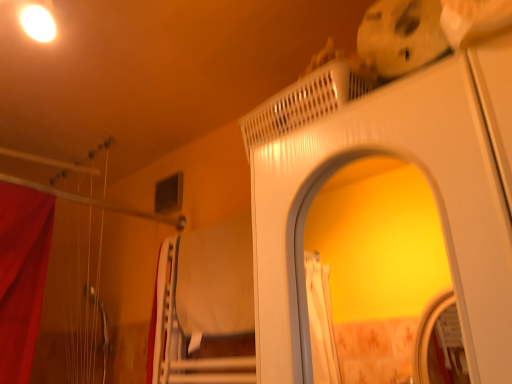
Question: Is white fabric curtain at lower left further to the viewer compared to white glossy screen door at upper center?

Choices:
 (A) no
 (B) yes

Answer: (B)

Question: Is white fabric curtain at lower left shorter than white glossy screen door at upper center?

Choices:
 (A) yes
 (B) no

Answer: (A)

Question: Is white fabric curtain at lower left to the right of white glossy screen door at upper center from the viewer's perspective?

Choices:
 (A) no
 (B) yes

Answer: (A)

Question: From the image's perspective, is white fabric curtain at lower left located above white glossy screen door at upper center?

Choices:
 (A) yes
 (B) no

Answer: (B)

Question: Is white fabric curtain at lower left taller than white glossy screen door at upper center?

Choices:
 (A) no
 (B) yes

Answer: (A)

Question: Is white fabric curtain at lower left thinner than white glossy screen door at upper center?

Choices:
 (A) no
 (B) yes

Answer: (B)

Question: Considering the relative sizes of white glossy screen door at upper center and white fabric curtain at lower left in the image provided, is white glossy screen door at upper center bigger than white fabric curtain at lower left?

Choices:
 (A) no
 (B) yes

Answer: (B)

Question: Can you confirm if white glossy screen door at upper center is wider than white fabric curtain at lower left?

Choices:
 (A) yes
 (B) no

Answer: (A)

Question: Is white glossy screen door at upper center at the right side of white fabric curtain at lower left?

Choices:
 (A) yes
 (B) no

Answer: (A)

Question: Does white glossy screen door at upper center have a greater height compared to white fabric curtain at lower left?

Choices:
 (A) yes
 (B) no

Answer: (A)

Question: Is the surface of white glossy screen door at upper center in direct contact with white fabric curtain at lower left?

Choices:
 (A) no
 (B) yes

Answer: (A)

Question: Is white glossy screen door at upper center outside white fabric curtain at lower left?

Choices:
 (A) no
 (B) yes

Answer: (B)

Question: Is white textured bed at center thinner than white glossy screen door at upper center?

Choices:
 (A) yes
 (B) no

Answer: (A)